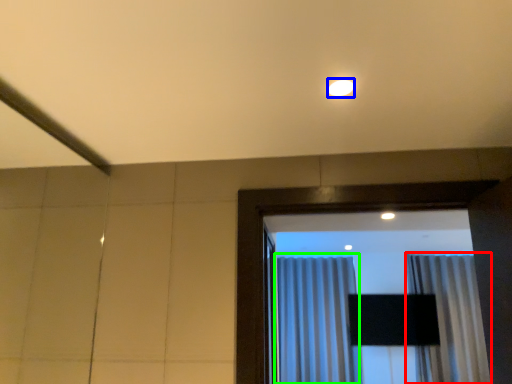
Question: Which object is positioned farthest from curtain (highlighted by a red box)? Select from lighting (highlighted by a blue box) and curtain (highlighted by a green box).

Choices:
 (A) lighting
 (B) curtain

Answer: (A)